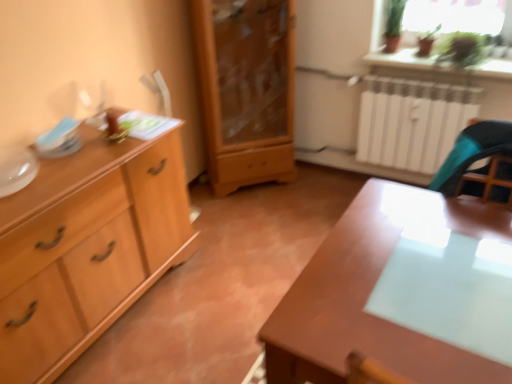
Where is `vacant space in front of light wood cabinet at center, arranged as the 1th chest of drawers when viewed from the right`? vacant space in front of light wood cabinet at center, arranged as the 1th chest of drawers when viewed from the right is located at coordinates (259, 215).